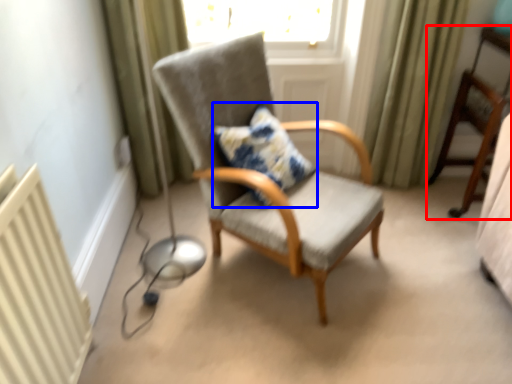
Question: Which object appears closest to the camera in this image, chair (highlighted by a red box) or pillow (highlighted by a blue box)?

Choices:
 (A) chair
 (B) pillow

Answer: (B)